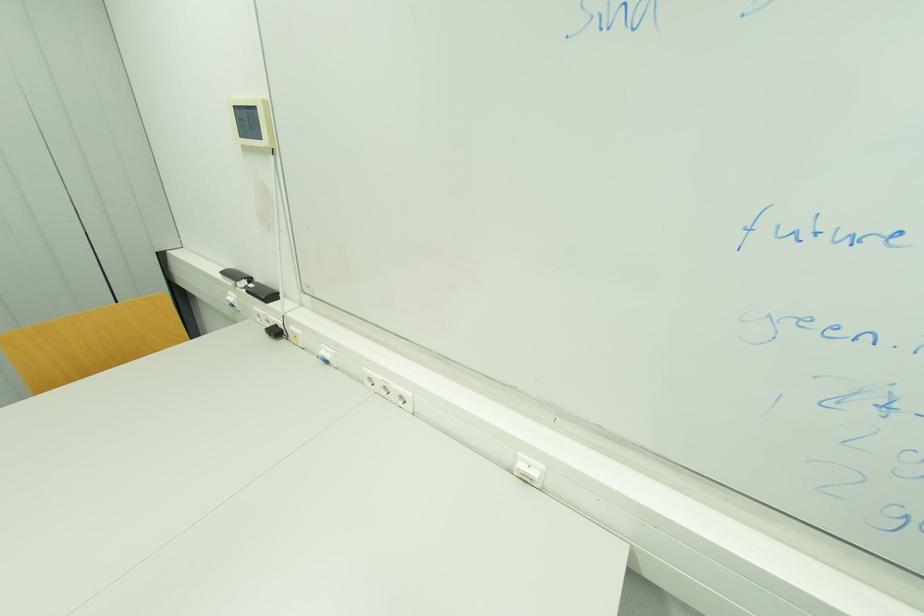
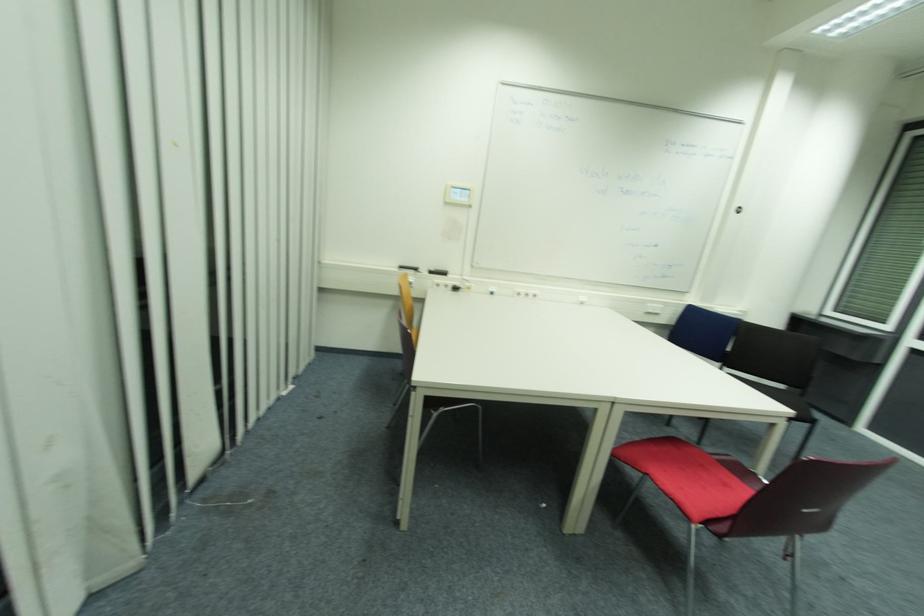
Where in the second image is the point corresponding to point (281, 333) from the first image?

(458, 290)